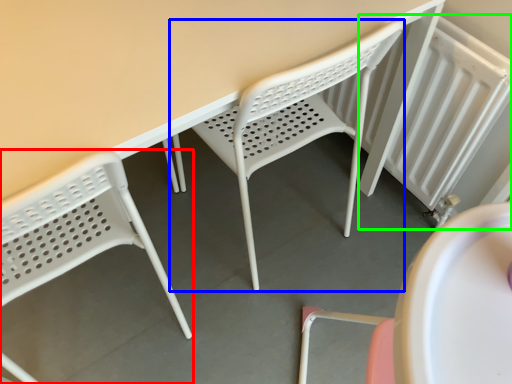
Question: Based on their relative distances, which object is farther from chair (highlighted by a red box)? Choose from chair (highlighted by a blue box) and radiator (highlighted by a green box).

Choices:
 (A) chair
 (B) radiator

Answer: (B)